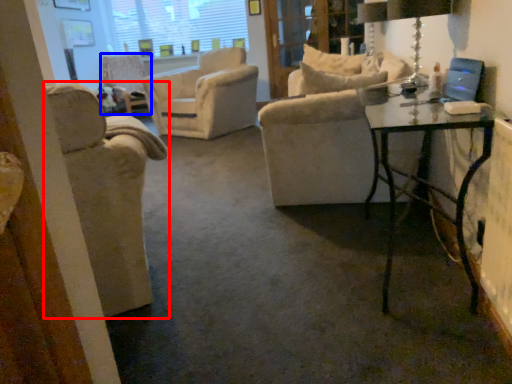
Question: Among these objects, which one is farthest to the camera, chair (highlighted by a red box) or chair (highlighted by a blue box)?

Choices:
 (A) chair
 (B) chair

Answer: (B)